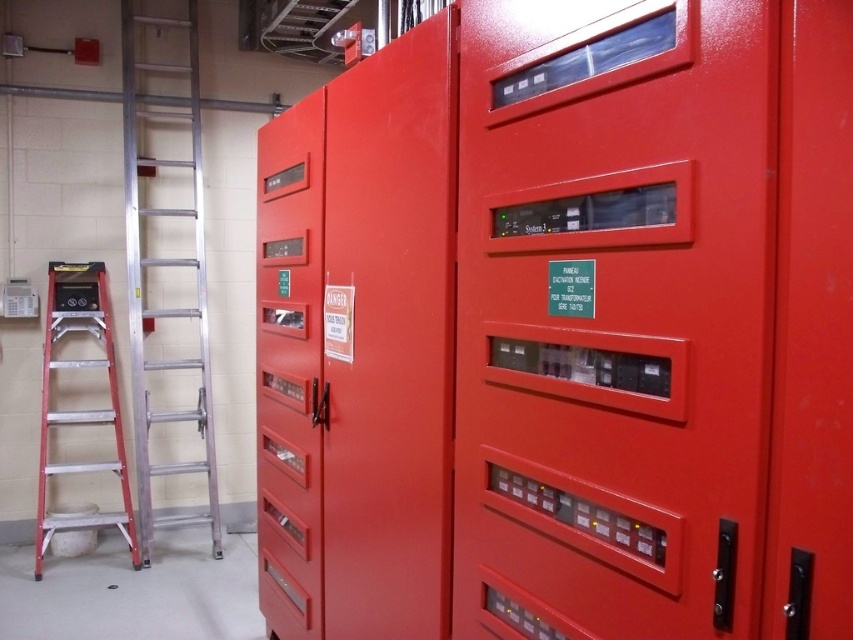
Is glossy red locker at center smaller than aluminum ladder at left?

No.

Which is in front, point (824, 506) or point (184, 417)?

Point (824, 506) is in front.

You are a GUI agent. You are given a task and a screenshot of the screen. Output one action in this format:
    pyautogui.click(x=<x>, y=<y>)
    Task: Click on the glossy red locker at center
    Image resolution: width=853 pixels, height=640 pixels.
    Given the screenshot: What is the action you would take?
    pyautogui.click(x=563, y=328)

Between aluminum ladder at left and metallic silver screwdriver at center, which one is positioned lower?

Positioned lower is metallic silver screwdriver at center.

Who is higher up, aluminum ladder at left or metallic silver screwdriver at center?

aluminum ladder at left is above.

Locate an element on the screen. The width and height of the screenshot is (853, 640). aluminum ladder at left is located at coordinates (164, 266).

Who is taller, glossy red locker at center or metallic silver screwdriver at center?

Standing taller between the two is glossy red locker at center.

Between point (737, 616) and point (317, 406), which one is positioned in front?

Point (737, 616)

The image size is (853, 640). In order to click on glossy red locker at center in this screenshot , I will do `click(563, 328)`.